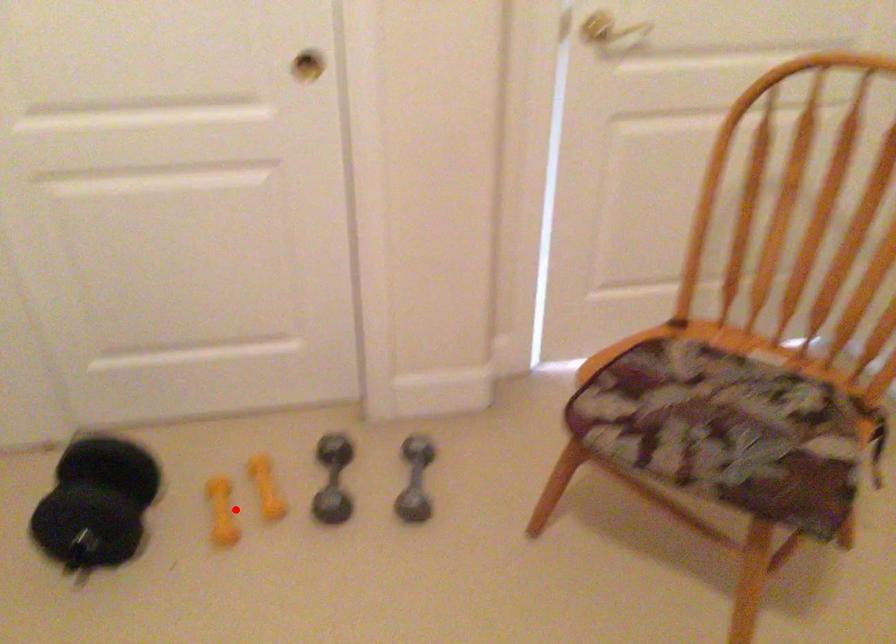
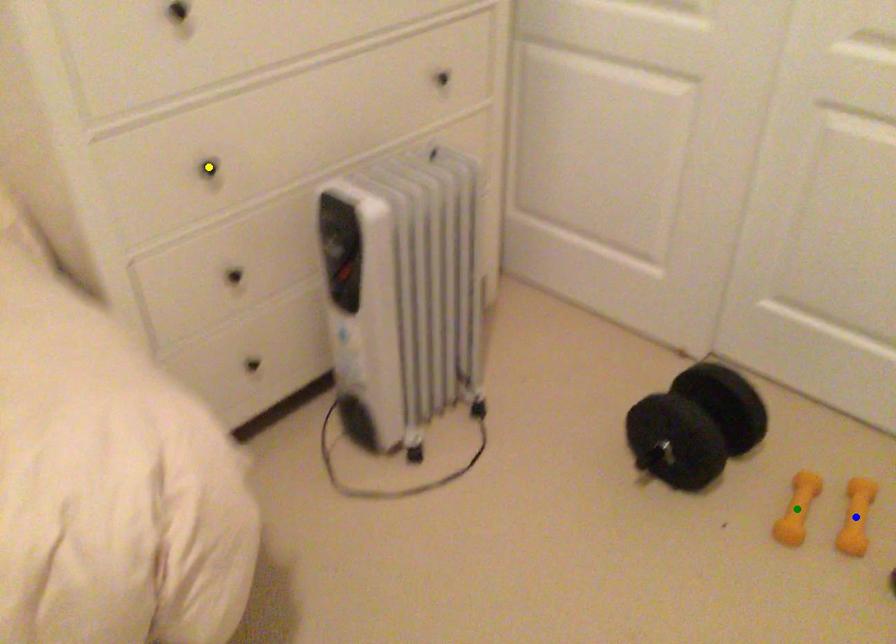
Question: I am providing you with two images of the same scene from different viewpoints. A red point is marked on the first image. You are given multiple points on the second image. Which point in image 2 represents the same 3d spot as the red point in image 1?

Choices:
 (A) yellow point
 (B) blue point
 (C) green point

Answer: (C)